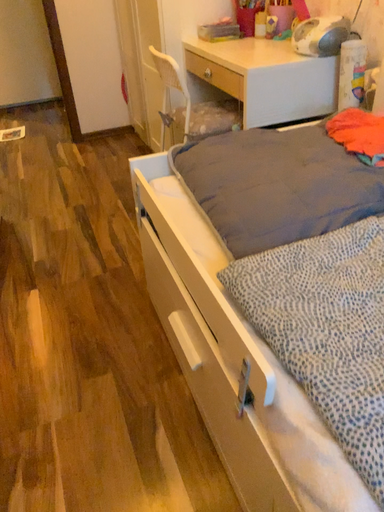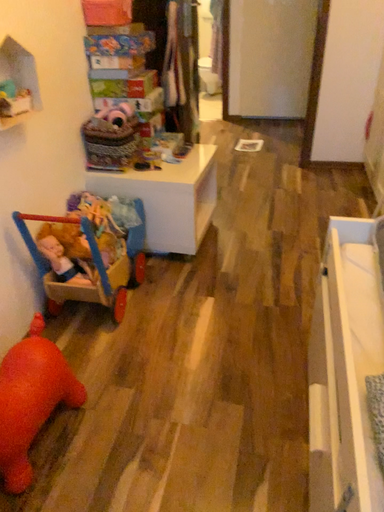
Question: Which way did the camera rotate in the video?

Choices:
 (A) rotated right
 (B) rotated left

Answer: (B)